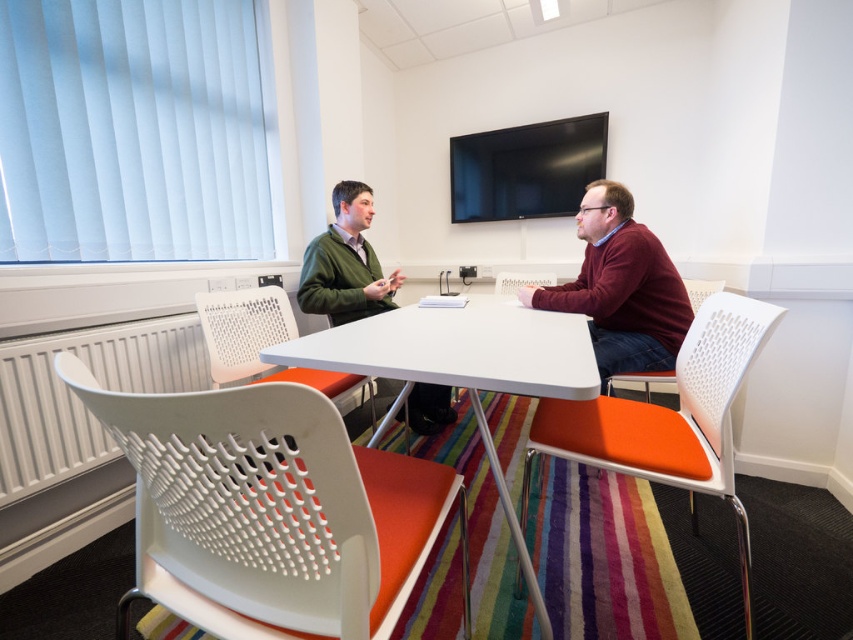
Question: Which point is closer to the camera?

Choices:
 (A) white plastic chair at center
 (B) maroon sweater at right
 (C) orange fabric chair at right

Answer: (C)

Question: Is orange fabric chair at right below white plastic chair at center?

Choices:
 (A) yes
 (B) no

Answer: (A)

Question: Can you confirm if orange fabric chair at right is bigger than white plastic chair at center?

Choices:
 (A) yes
 (B) no

Answer: (B)

Question: Which point is closer to the camera?

Choices:
 (A) orange fabric chair at right
 (B) white perforated chair at center

Answer: (A)

Question: Which point is closer to the camera taking this photo?

Choices:
 (A) pos(688,292)
 (B) pos(363,330)
 (C) pos(13,468)

Answer: (B)

Question: Where is white plastic chair at lower left located in relation to white glossy table at center in the image?

Choices:
 (A) right
 (B) left

Answer: (B)